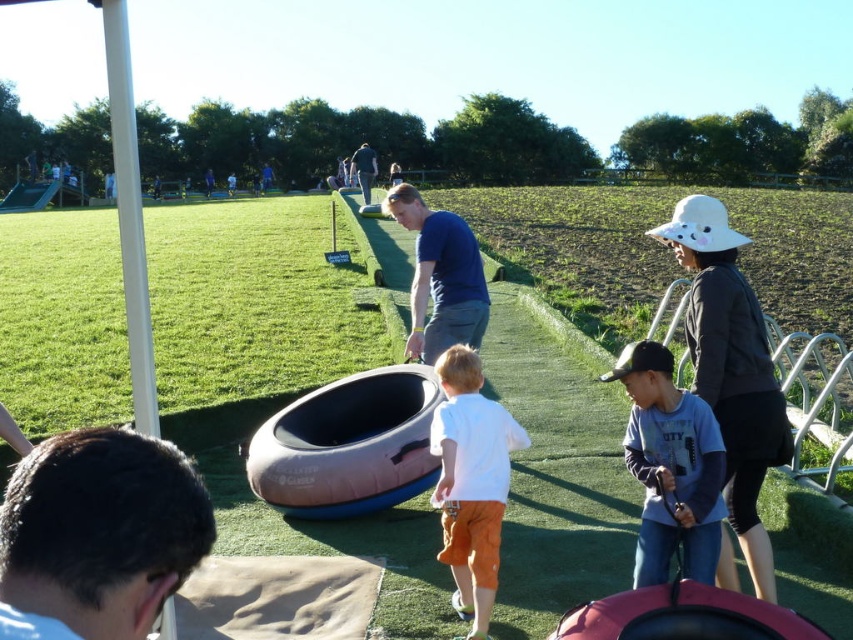
Does white fabric hat at right appear on the right side of blue shirt at center?

Correct, you'll find white fabric hat at right to the right of blue shirt at center.

Who is more forward, (704, 355) or (361, 154)?

Point (704, 355)

You are a GUI agent. You are given a task and a screenshot of the screen. Output one action in this format:
    pyautogui.click(x=<x>, y=<y>)
    Task: Click on the white fabric hat at right
    Image resolution: width=853 pixels, height=640 pixels.
    Given the screenshot: What is the action you would take?
    pyautogui.click(x=730, y=369)

Is white cotton shirt at center thinner than blue cotton shirt at center?

Indeed, white cotton shirt at center has a lesser width compared to blue cotton shirt at center.

Who is positioned more to the right, white cotton shirt at center or blue cotton shirt at center?

white cotton shirt at center

Is point (492, 525) positioned after point (451, 269)?

No, (492, 525) is closer to viewer.

Where is `white cotton shirt at center`? This screenshot has height=640, width=853. white cotton shirt at center is located at coordinates (471, 481).

Can you confirm if brown hair at lower left is wider than white cotton shirt at center?

In fact, brown hair at lower left might be narrower than white cotton shirt at center.

Which is more to the right, brown hair at lower left or white cotton shirt at center?

From the viewer's perspective, white cotton shirt at center appears more on the right side.

Does point (32, 522) come in front of point (467, 563)?

Yes, point (32, 522) is in front of point (467, 563).

I want to click on brown hair at lower left, so click(x=102, y=531).